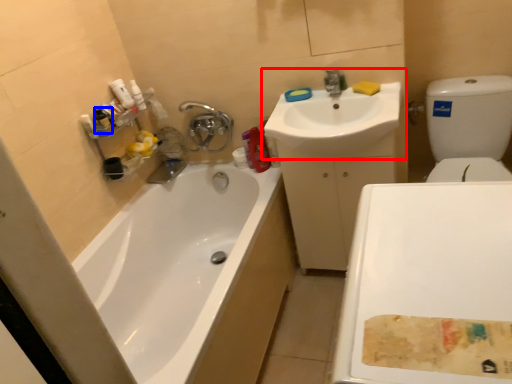
Question: Which of the following is the closest to the observer, sink (highlighted by a red box) or mouthwash (highlighted by a blue box)?

Choices:
 (A) sink
 (B) mouthwash

Answer: (A)